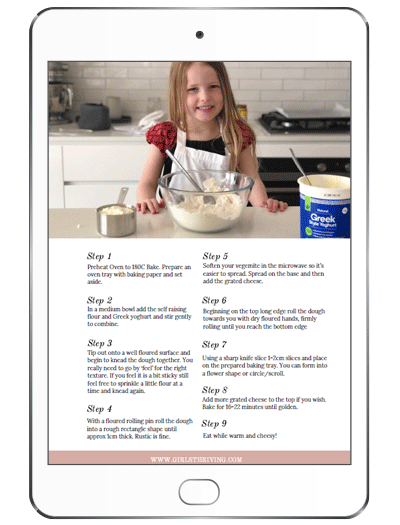
Identify the location of cabinet drawers. (109, 162), (95, 198).